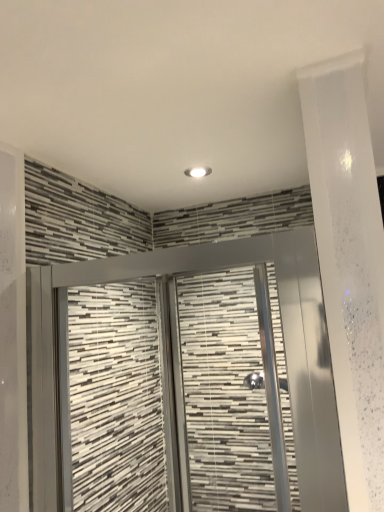
At what (x,y) coordinates should I click in order to perform the action: click on metallic glass door at center. Please return your answer as a coordinate pair (x, y). The image size is (384, 512). Looking at the image, I should click on (283, 335).

The width and height of the screenshot is (384, 512). Describe the element at coordinates (283, 335) in the screenshot. I see `metallic glass door at center` at that location.

Measure the distance between point (67, 493) and camera.

Point (67, 493) is 1.05 meters from camera.

Measure the distance between metallic glass door at center and camera.

They are 73.85 centimeters apart.

This screenshot has width=384, height=512. Identify the location of metallic glass door at center. (283, 335).